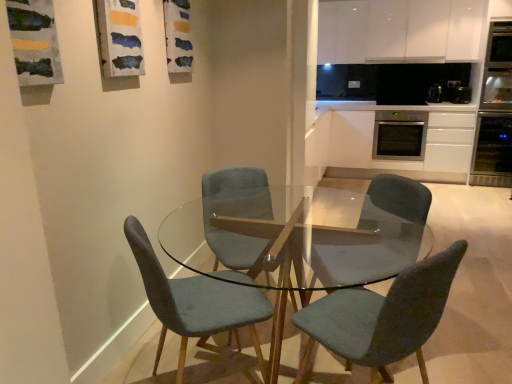
Question: Is stainless steel oven at center-right directly adjacent to black plastic toaster at upper right, which ranks as the second appliance in right-to-left order?

Choices:
 (A) no
 (B) yes

Answer: (A)

Question: From a real-world perspective, is stainless steel oven at center-right physically below black plastic toaster at upper right, acting as the 2th appliance starting from the left?

Choices:
 (A) no
 (B) yes

Answer: (B)

Question: Does stainless steel oven at center-right turn towards black plastic toaster at upper right, acting as the 2th appliance starting from the left?

Choices:
 (A) yes
 (B) no

Answer: (B)

Question: Is stainless steel oven at center-right to the right of black plastic toaster at upper right, which ranks as the second appliance in right-to-left order, from the viewer's perspective?

Choices:
 (A) no
 (B) yes

Answer: (A)

Question: Can you confirm if stainless steel oven at center-right is positioned to the left of black plastic toaster at upper right, acting as the 2th appliance starting from the left?

Choices:
 (A) no
 (B) yes

Answer: (B)

Question: Is point (175, 246) closer or farther from the camera than point (479, 178)?

Choices:
 (A) farther
 (B) closer

Answer: (B)

Question: Would you say transparent glass table at center is inside or outside satin black oven at right?

Choices:
 (A) outside
 (B) inside

Answer: (A)

Question: From the image's perspective, is transparent glass table at center positioned above or below satin black oven at right?

Choices:
 (A) above
 (B) below

Answer: (B)

Question: Considering the positions of transparent glass table at center and satin black oven at right in the image, is transparent glass table at center taller or shorter than satin black oven at right?

Choices:
 (A) short
 (B) tall

Answer: (A)

Question: Is stainless steel oven at right, marked as the first appliance in a right-to-left arrangement, situated inside velvet teal chair at center, placed as the 2th chair when sorted from left to right, or outside?

Choices:
 (A) inside
 (B) outside

Answer: (B)

Question: From a real-world perspective, is stainless steel oven at right, positioned as the third appliance in left-to-right order, above or below velvet teal chair at center, the second chair positioned from the right?

Choices:
 (A) above
 (B) below

Answer: (A)

Question: Based on their positions, is stainless steel oven at right, positioned as the third appliance in left-to-right order, located to the left or right of velvet teal chair at center, the second chair positioned from the right?

Choices:
 (A) right
 (B) left

Answer: (A)

Question: Considering the positions of point (485, 59) and point (206, 241), is point (485, 59) closer or farther from the camera than point (206, 241)?

Choices:
 (A) closer
 (B) farther

Answer: (B)

Question: From their relative heights in the image, would you say stainless steel oven at center-right is taller or shorter than satin black oven at right, which is the 1th appliance from left to right?

Choices:
 (A) short
 (B) tall

Answer: (B)

Question: Is stainless steel oven at center-right situated inside satin black oven at right, which is the 1th appliance from left to right, or outside?

Choices:
 (A) inside
 (B) outside

Answer: (B)